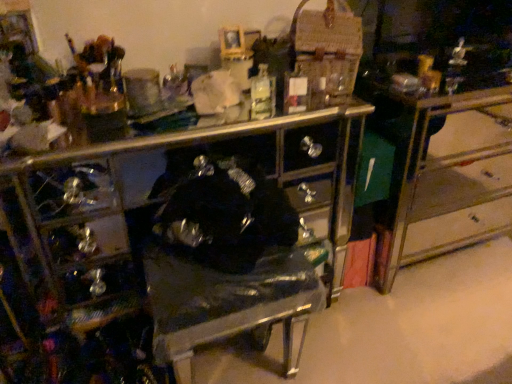
What do you see at coordinates (449, 175) in the screenshot?
I see `metallic silver table at center` at bounding box center [449, 175].

The height and width of the screenshot is (384, 512). What are the coordinates of `metallic silver table at center` in the screenshot? It's located at (449, 175).

Image resolution: width=512 pixels, height=384 pixels. In order to click on metallic silver table at center in this screenshot , I will do `click(449, 175)`.